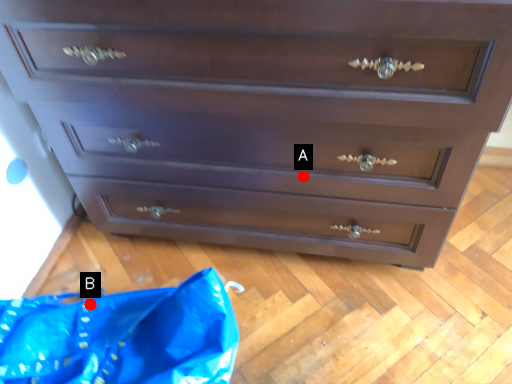
Question: Two points are circled on the image, labeled by A and B beside each circle. Which point is further to the camera?

Choices:
 (A) A is further
 (B) B is further

Answer: (B)